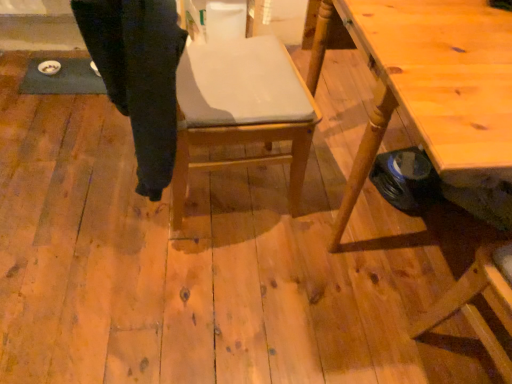
The image size is (512, 384). Identify the location of wooden chair at center. (241, 110).

What do you see at coordinates (241, 110) in the screenshot? I see `wooden chair at center` at bounding box center [241, 110].

Measure the distance between black cotton trousers at center and camera.

32.62 inches.

Find the location of a particular element. wooden table at right is located at coordinates (429, 84).

Which point is more distant from viewer, (138, 144) or (207, 136)?

Point (207, 136)

Who is smaller, black cotton trousers at center or wooden chair at center?

black cotton trousers at center.

In the scene shown: Is black cotton trousers at center positioned in front of wooden chair at center?

Yes, black cotton trousers at center is closer to the camera.

Does black cotton trousers at center have a greater height compared to wooden chair at center?

In fact, black cotton trousers at center may be shorter than wooden chair at center.

Is wooden chair at center turned away from wooden table at right?

That's not correct — wooden chair at center is not looking away from wooden table at right.

Considering the sizes of wooden chair at center and wooden table at right in the image, is wooden chair at center bigger or smaller than wooden table at right?

wooden chair at center is smaller than wooden table at right.

Measure the distance between wooden chair at center and wooden table at right.

wooden chair at center and wooden table at right are 13.61 inches apart from each other.

Is wooden chair at center wider than wooden table at right?

Incorrect, the width of wooden chair at center does not surpass that of wooden table at right.

From a real-world perspective, is wooden chair at center physically below black cotton trousers at center?

Yes, from a real-world perspective, wooden chair at center is under black cotton trousers at center.

From the image's perspective, does wooden chair at center appear higher than black cotton trousers at center?

No, from the image's perspective, wooden chair at center is not on top of black cotton trousers at center.

Between wooden chair at center and black cotton trousers at center, which one has more height?

Standing taller between the two is wooden chair at center.

From the picture: How different are the orientations of wooden table at right and wooden chair at center in degrees?

173 degrees.

Is wooden table at right looking in the opposite direction of wooden chair at center?

No, wooden chair at center is not at the back of wooden table at right.

Is wooden table at right to the left or to the right of wooden chair at center in the image?

Clearly, wooden table at right is on the right of wooden chair at center in the image.

Image resolution: width=512 pixels, height=384 pixels. I want to click on chair that appears on the left of wooden table at right, so click(241, 110).

Could black cotton trousers at center be considered to be inside wooden table at right?

No, black cotton trousers at center is not surrounded by wooden table at right.

Could you tell me if wooden table at right is turned towards black cotton trousers at center?

Yes, wooden table at right is oriented towards black cotton trousers at center.

From the image's perspective, is wooden table at right beneath black cotton trousers at center?

Correct, wooden table at right appears lower than black cotton trousers at center in the image.

Is black cotton trousers at center far away from wooden table at right?

That's not correct — black cotton trousers at center is a little close to wooden table at right.

Is black cotton trousers at center oriented away from wooden table at right?

No, wooden table at right is not at the back of black cotton trousers at center.

Is point (81, 31) behind point (416, 62)?

Yes, point (81, 31) is behind point (416, 62).

From the image's perspective, is black cotton trousers at center above or below wooden table at right?

From the image's perspective, black cotton trousers at center appears above wooden table at right.

Where is `chair below the black cotton trousers at center (from the image's perspective)`? This screenshot has height=384, width=512. chair below the black cotton trousers at center (from the image's perspective) is located at coordinates (241, 110).

I want to click on chair on the left side of wooden table at right, so click(x=241, y=110).

When comparing their distances from wooden table at right, does wooden chair at center or black cotton trousers at center seem further?

Among the two, black cotton trousers at center is located further to wooden table at right.

Estimate the real-world distances between objects in this image. Which object is closer to black cotton trousers at center, wooden chair at center or wooden table at right?

wooden chair at center.

From the image, which object appears to be nearer to black cotton trousers at center, wooden table at right or wooden chair at center?

Among the two, wooden chair at center is located nearer to black cotton trousers at center.

Considering their positions, is black cotton trousers at center positioned closer to wooden table at right than wooden chair at center?

Among the two, wooden chair at center is located nearer to wooden table at right.

Looking at the image, which one is located closer to wooden chair at center, black cotton trousers at center or wooden table at right?

Among the two, black cotton trousers at center is located nearer to wooden chair at center.

Consider the image. Considering their positions, is wooden table at right positioned closer to wooden chair at center than black cotton trousers at center?

black cotton trousers at center.

This screenshot has width=512, height=384. Identify the location of chair between black cotton trousers at center and wooden table at right in the horizontal direction. (241, 110).